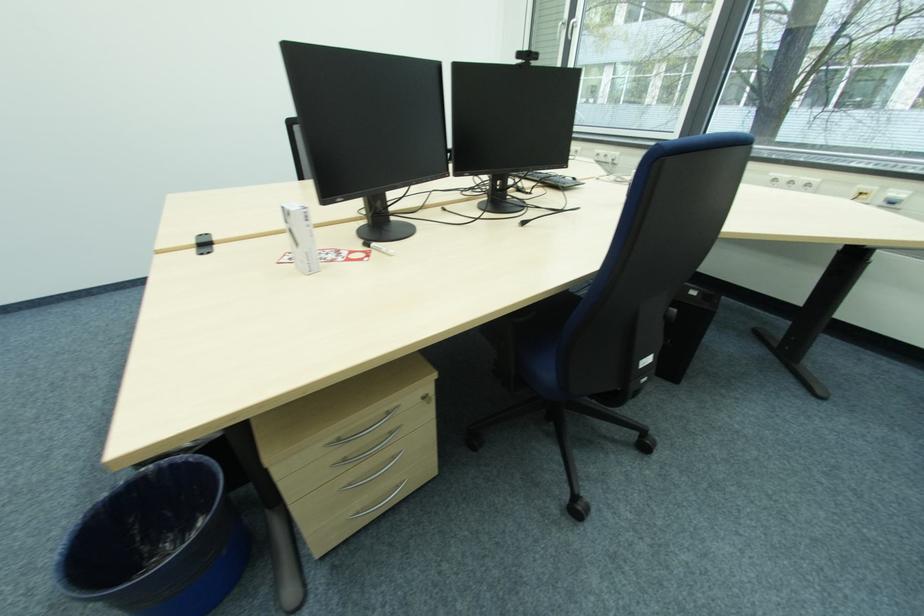
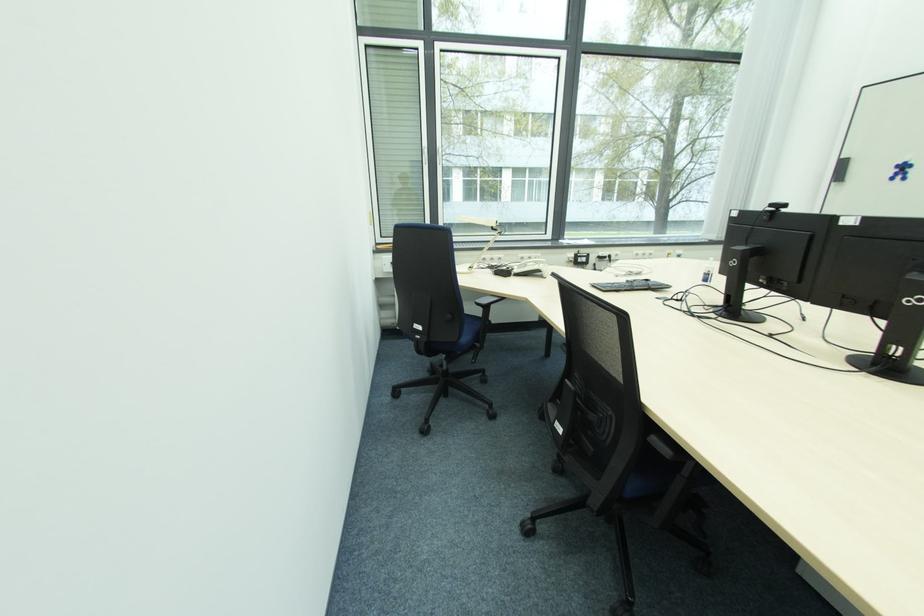
Locate, in the second image, the point that corresponds to point 577,180 in the first image.

(650, 283)